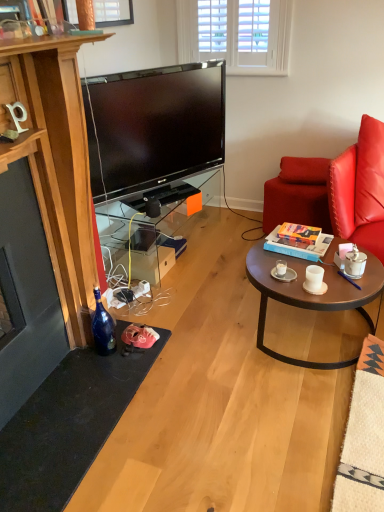
Question: From a real-world perspective, is white matte coffee cup at center right, which ranks as the 2th coffee cup in left-to-right order, physically located above or below leather swivel chair at right?

Choices:
 (A) above
 (B) below

Answer: (A)

Question: Considering the positions of point (306, 269) and point (301, 179), is point (306, 269) closer or farther from the camera than point (301, 179)?

Choices:
 (A) farther
 (B) closer

Answer: (B)

Question: Which is farther from the white matte coffee cup at center right, which ranks as the 2th coffee cup in left-to-right order?

Choices:
 (A) hardcover book at center
 (B) white ceramic cup at center, which is counted as the third coffee cup, starting from the right
 (C) purple plastic pen at coffee table
 (D) leather cushion at right
 (E) transparent glass tv stand at center

Answer: (E)

Question: Which object is the farthest from the blue glass bottle at lower left?

Choices:
 (A) white ceramic coffee cup at right, the third coffee cup positioned from the left
 (B) purple plastic pen at coffee table
 (C) leather cushion at right
 (D) white matte coffee cup at center right, which ranks as the 2th coffee cup in left-to-right order
 (E) white ceramic cup at center, which is the first coffee cup in left-to-right order

Answer: (C)